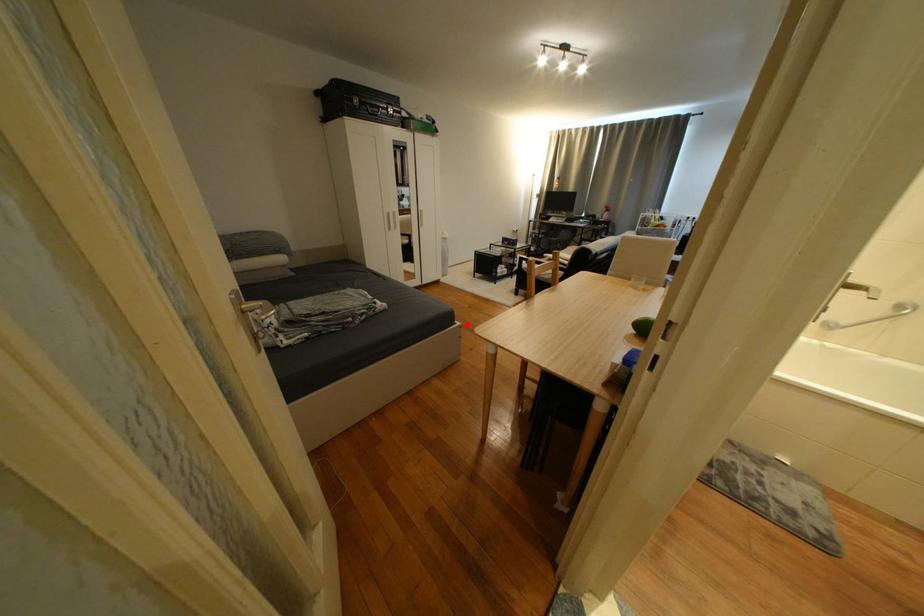
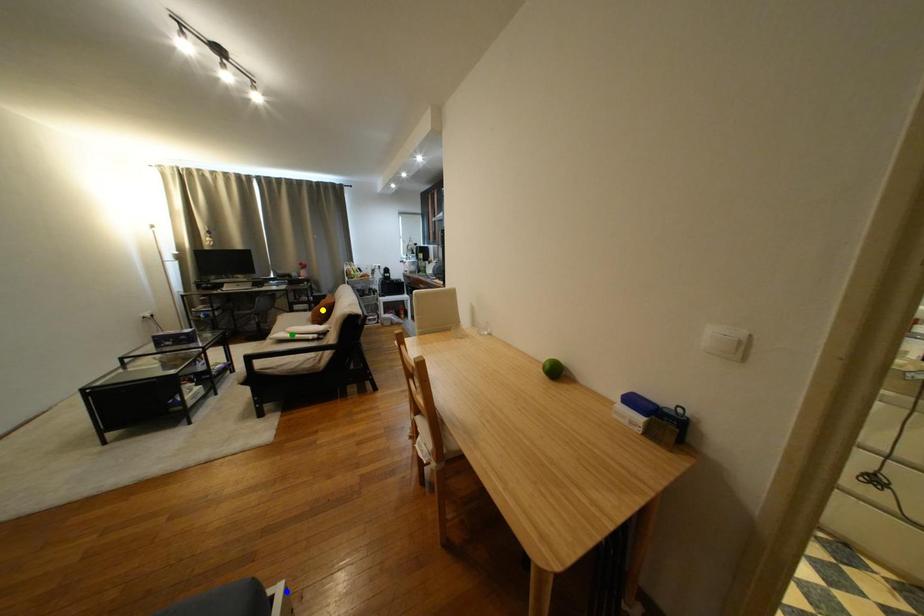
Question: I am providing you with two images of the same scene from different viewpoints. A red point is marked on the first image. You are given multiple points on the second image. Which point in image 2 is actually the same real-world point as the red point in image 1?

Choices:
 (A) blue point
 (B) yellow point
 (C) green point

Answer: (A)